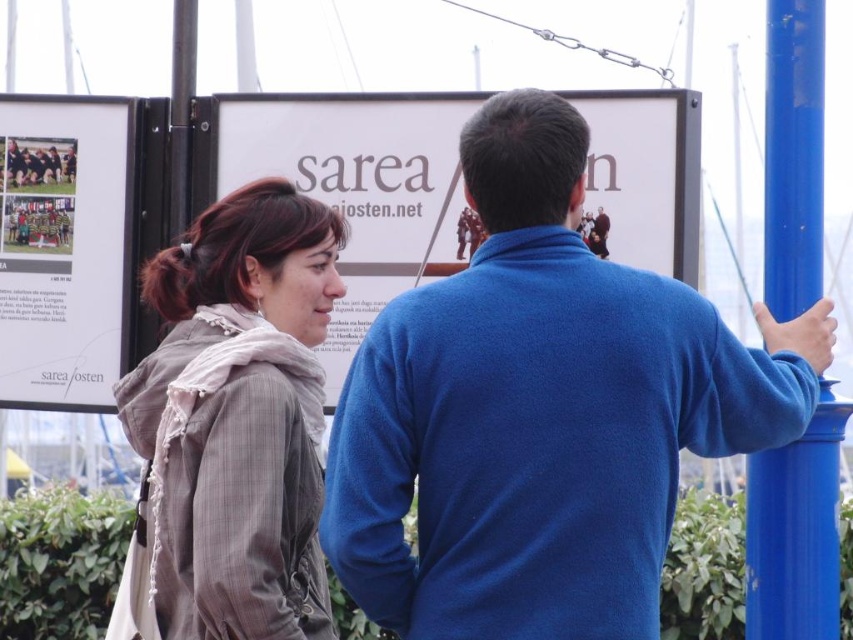
Is point (170, 513) closer to viewer compared to point (93, 262)?

Yes, it is in front of point (93, 262).

Between point (228, 612) and point (108, 275), which one is positioned behind?

Point (108, 275)

Where is `gray textured coat at center`? Image resolution: width=853 pixels, height=640 pixels. gray textured coat at center is located at coordinates (236, 419).

Who is lower down, blue fleece jacket at center or gray textured coat at center?

Positioned lower is blue fleece jacket at center.

How far apart are blue fleece jacket at center and gray textured coat at center?

The distance of blue fleece jacket at center from gray textured coat at center is 5.71 meters.

Is point (566, 246) farther from camera compared to point (212, 492)?

Yes, it is.

This screenshot has width=853, height=640. Find the location of `blue fleece jacket at center`. blue fleece jacket at center is located at coordinates (541, 412).

Is white paper at upper left to the right of blue metallic pole at right from the viewer's perspective?

Incorrect, white paper at upper left is not on the right side of blue metallic pole at right.

At what (x,y) coordinates should I click in order to perform the action: click on white paper at upper left. Please return your answer as a coordinate pair (x, y). Looking at the image, I should click on (64, 248).